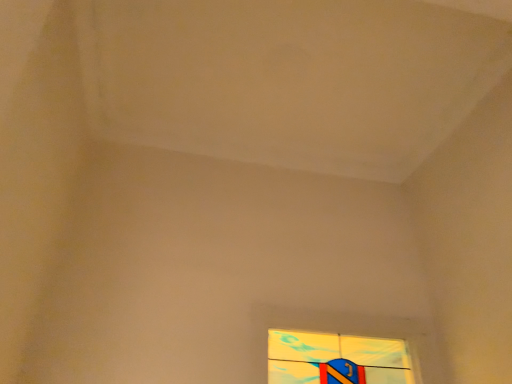
Measure the distance between translucent glass window at lower center and camera.

translucent glass window at lower center and camera are 6.55 feet apart.

This screenshot has width=512, height=384. Describe the element at coordinates (336, 359) in the screenshot. I see `translucent glass window at lower center` at that location.

Identify the location of translucent glass window at lower center. Image resolution: width=512 pixels, height=384 pixels. (336, 359).

This screenshot has width=512, height=384. What are the coordinates of `translucent glass window at lower center` in the screenshot? It's located at (336, 359).